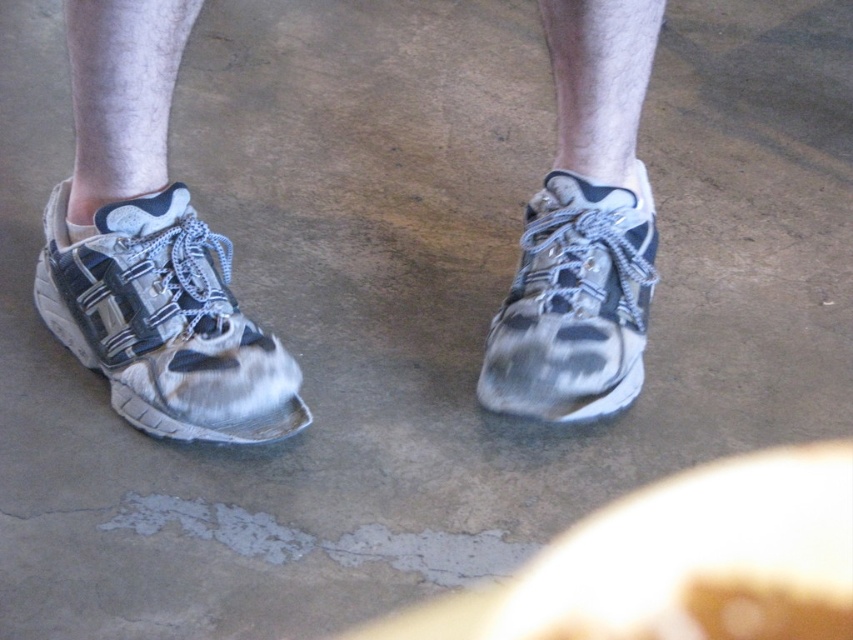
Question: Which point is farther to the camera?

Choices:
 (A) (204, 276)
 (B) (560, 241)
 (C) (534, 333)

Answer: (B)

Question: Does worn leather sneaker at left have a greater width compared to worn leather sneaker at center?

Choices:
 (A) no
 (B) yes

Answer: (B)

Question: Is worn leather sneakers at center thinner than worn leather sneaker at center?

Choices:
 (A) yes
 (B) no

Answer: (B)

Question: Which point appears closest to the camera in this image?

Choices:
 (A) (234, 429)
 (B) (181, 356)
 (C) (486, 381)

Answer: (A)

Question: Observing the image, what is the correct spatial positioning of worn leather sneaker at left in reference to worn leather sneaker at center?

Choices:
 (A) left
 (B) right

Answer: (A)

Question: Which object appears closest to the camera in this image?

Choices:
 (A) worn leather sneakers at center
 (B) worn leather sneaker at left
 (C) worn leather sneaker at center

Answer: (A)